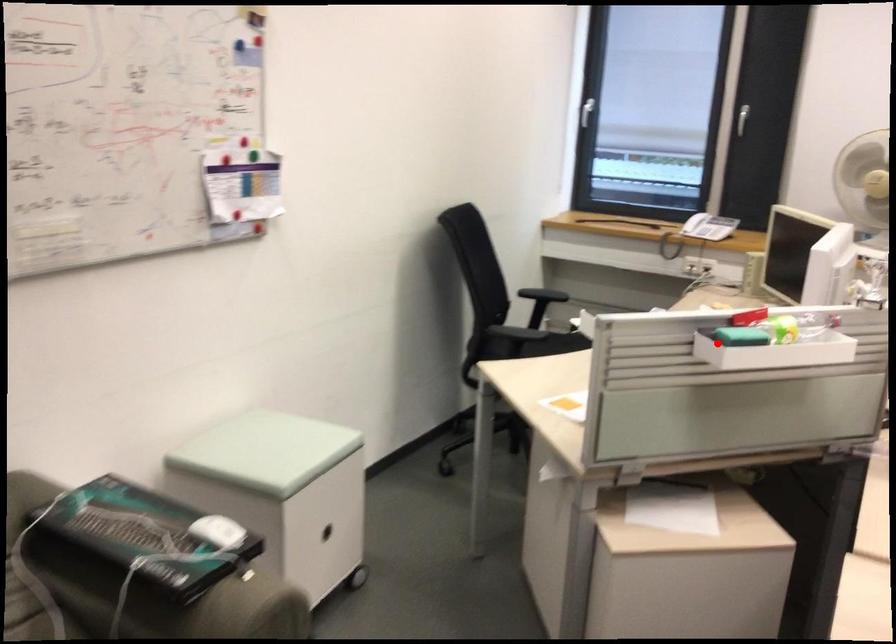
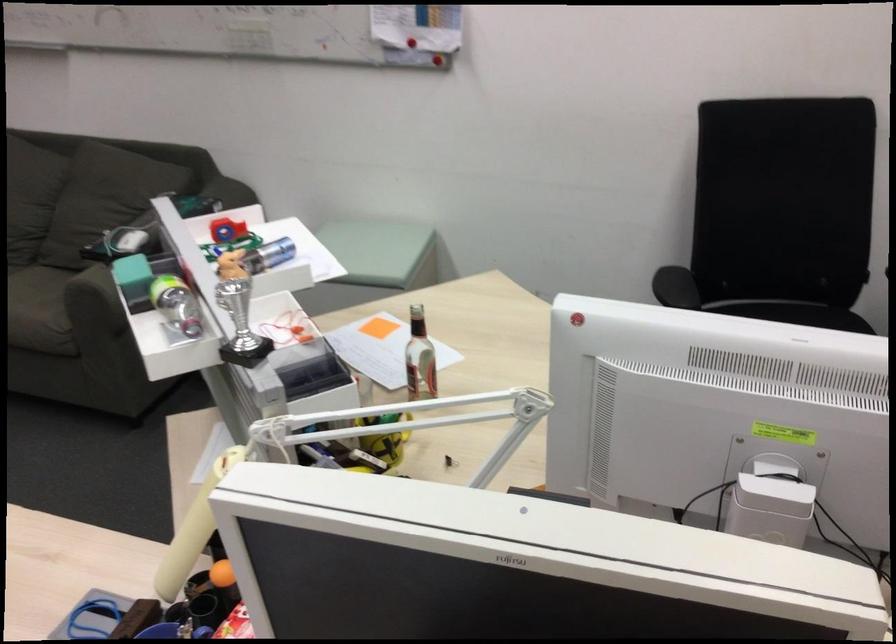
Find the pixel in the second image that matches the highlighted location in the first image.

(240, 324)